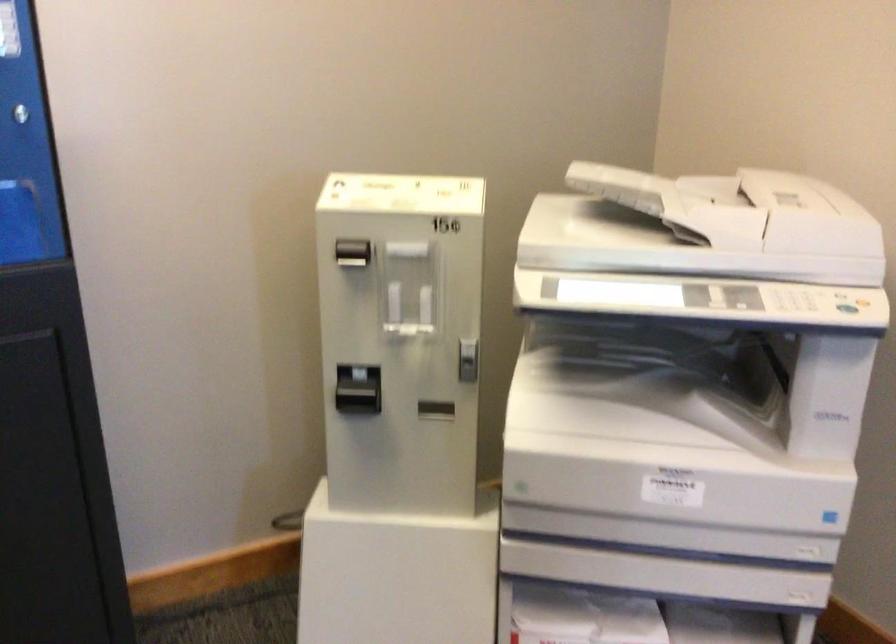
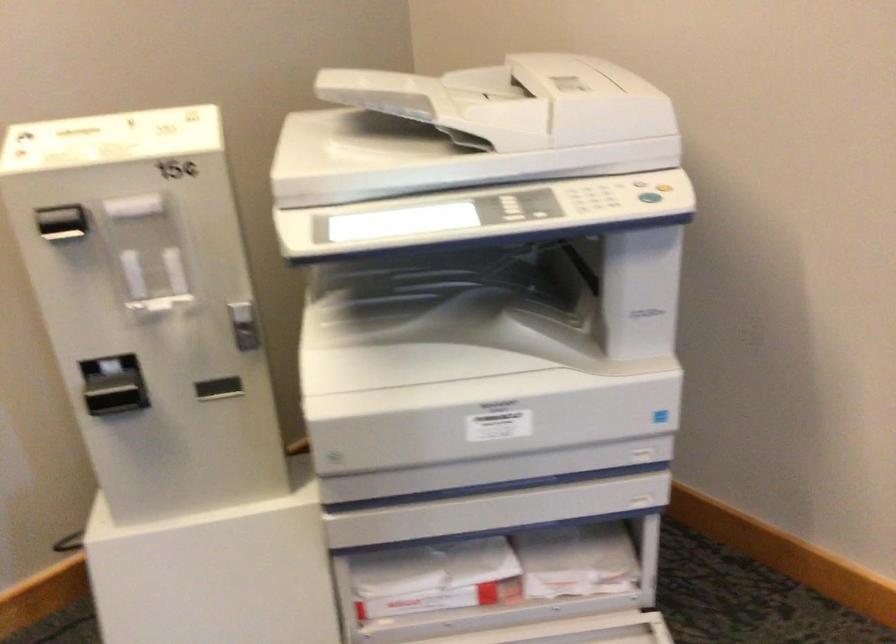
Question: Which direction would the cameraman need to move to produce the second image? Reply with the corresponding letter.

Choices:
 (A) Left
 (B) Right
 (C) Forward
 (D) Backward

Answer: (C)